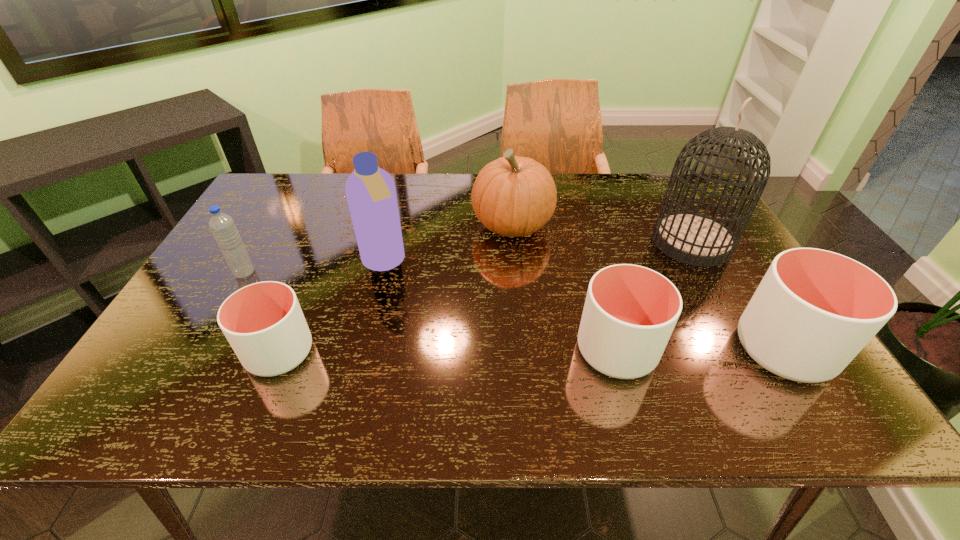
This screenshot has width=960, height=540. I want to click on cup that stands as the second closest to the second shortest cup, so click(x=263, y=322).

Select which cup appears as the second closest to the shampoo. Please provide its 2D coordinates. Your answer should be formatted as a tuple, i.e. [(x, y)], where the tuple contains the x and y coordinates of a point satisfying the conditions above.

[(630, 311)]

The width and height of the screenshot is (960, 540). What are the coordinates of `free region that satisfies the following two spatial constraints: 1. on the back side of the rightmost cup; 2. on the stem of the pumpkin` in the screenshot? It's located at (706, 225).

Identify the location of vacant space that satisfies the following two spatial constraints: 1. on the stem of the pumpkin; 2. on the back side of the second shortest object. (523, 350).

Locate an element on the screen. The image size is (960, 540). free space that satisfies the following two spatial constraints: 1. on the back side of the leftmost object; 2. on the right side of the birdcage is located at coordinates (262, 242).

You are a GUI agent. You are given a task and a screenshot of the screen. Output one action in this format:
    pyautogui.click(x=<x>, y=<y>)
    Task: Click on the free space that satisfies the following two spatial constraints: 1. on the stem of the pumpkin; 2. on the back side of the rightmost cup
    This screenshot has height=540, width=960.
    Given the screenshot: What is the action you would take?
    pyautogui.click(x=523, y=349)